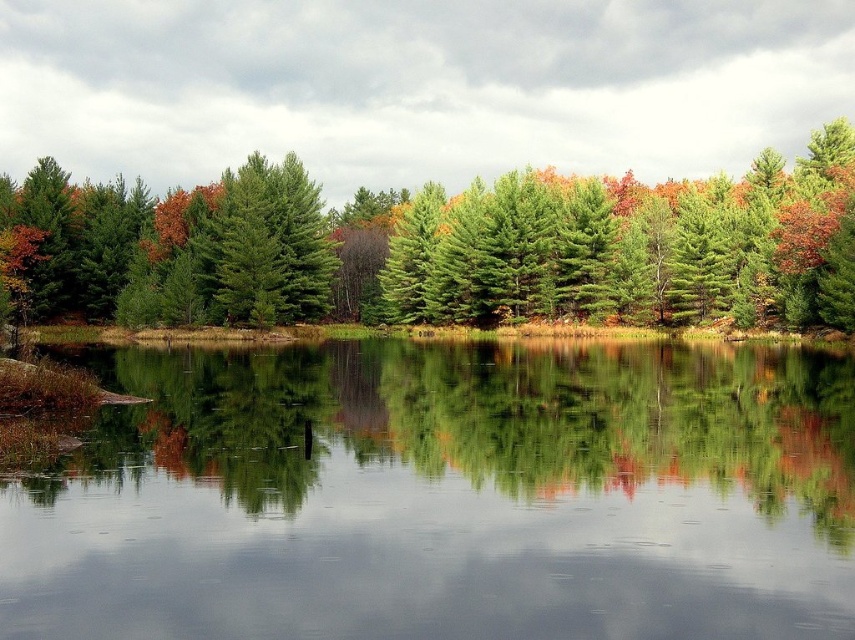
You are an artist planning to paint the landscape. You want to ensure the smooth reflective water at center and the green pine trees at center are proportionally accurate. Which object should you make larger in your painting?

The green pine trees at center should be made larger than the smooth reflective water at center in the painting since the description states that the smooth reflective water at center is smaller than the green pine trees at center.

You are standing at the edge of the lake and notice the smooth reflective water at center and the green pine trees at center. Which of these two elements has a smaller width in the scene?

The smooth reflective water at center has a lesser width compared to the green pine trees at center, so the smooth reflective water at center is the one with the smaller width.